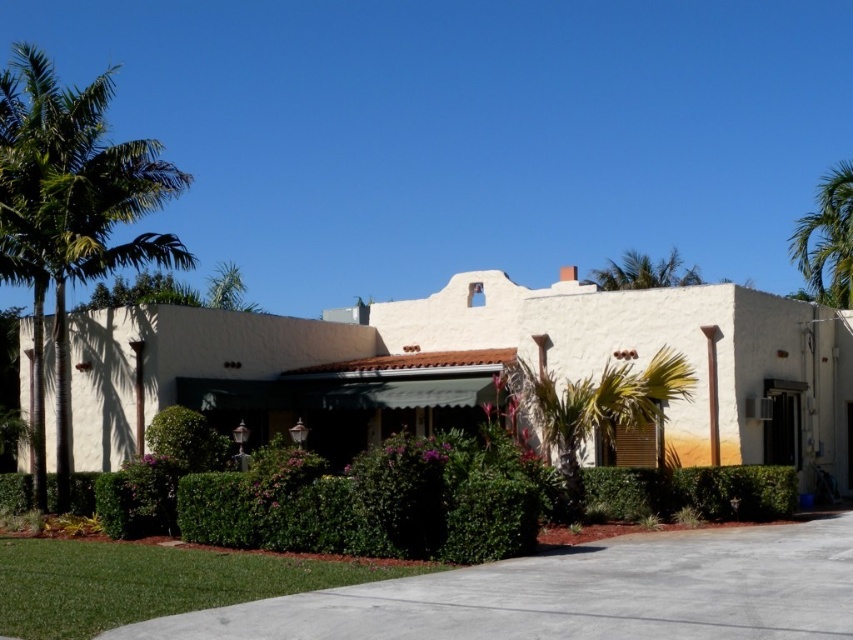
Question: Which of the following is the farthest from the observer?

Choices:
 (A) green leafy bush at center
 (B) green grass at lower left

Answer: (A)

Question: Does gray concrete driveway at lower center appear on the right side of green grass at lower left?

Choices:
 (A) no
 (B) yes

Answer: (B)

Question: Does green grass at lower left come behind green leafy palm tree at upper right?

Choices:
 (A) yes
 (B) no

Answer: (B)

Question: Which object is closer to the camera taking this photo?

Choices:
 (A) green leafy bush at center
 (B) green leafy palm tree at upper center

Answer: (A)

Question: Can you confirm if gray concrete driveway at lower center is bigger than green leafy palm tree at upper right?

Choices:
 (A) no
 (B) yes

Answer: (A)

Question: Which object is closer to the camera taking this photo?

Choices:
 (A) green leafy palm tree at upper right
 (B) green grass at lower left
 (C) gray concrete driveway at lower center
 (D) green leafy palm tree at upper center

Answer: (C)